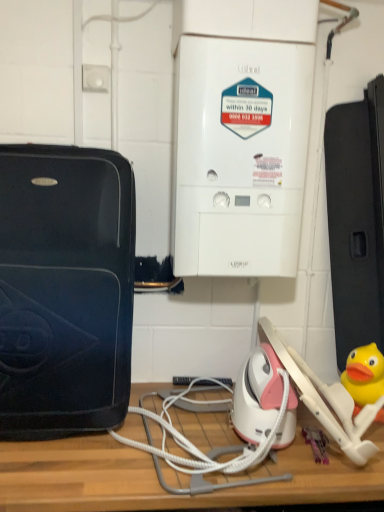
Find the location of a particular element. This screenshot has height=512, width=384. free space above white cord at center (from a real-world perspective) is located at coordinates (203, 423).